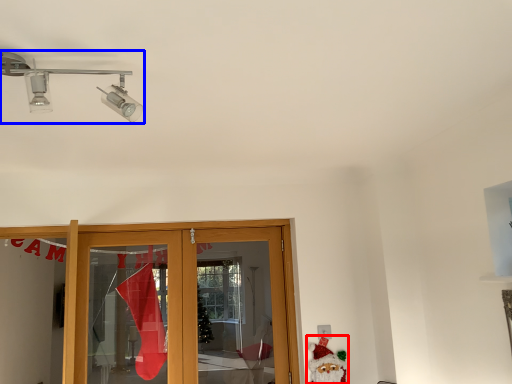
Question: Which object appears closest to the camera in this image, santa claus (highlighted by a red box) or light fixture (highlighted by a blue box)?

Choices:
 (A) santa claus
 (B) light fixture

Answer: (B)